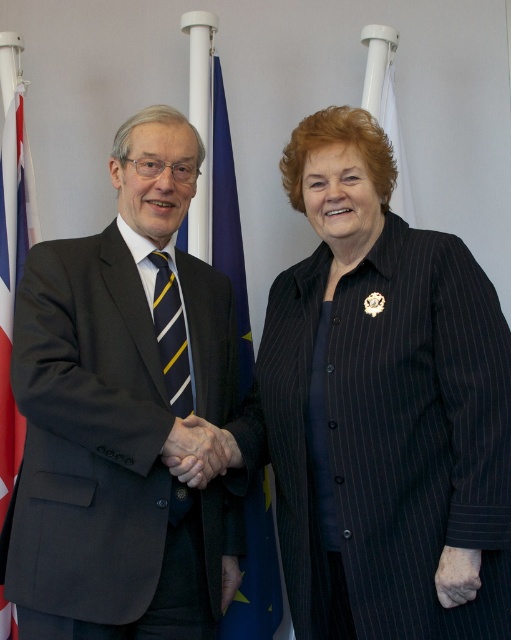
Question: Considering the relative positions of dark gray suit at left and black pinstripe coat at center in the image provided, where is dark gray suit at left located with respect to black pinstripe coat at center?

Choices:
 (A) below
 (B) above

Answer: (B)

Question: Can you confirm if black pinstripe coat at center is smaller than blue fabric flag at center?

Choices:
 (A) yes
 (B) no

Answer: (B)

Question: Which object is farther from the camera taking this photo?

Choices:
 (A) black pinstripe coat at center
 (B) red fabric flag at left
 (C) smooth skin hand at center

Answer: (B)

Question: Which object is the farthest from the dark gray suit at left?

Choices:
 (A) black pinstripe coat at center
 (B) blue fabric flag at center
 (C) red fabric flag at left
 (D) smooth skin hand at center

Answer: (C)

Question: Does blue fabric flag at center appear on the left side of red fabric flag at left?

Choices:
 (A) yes
 (B) no

Answer: (B)

Question: Considering the real-world distances, which object is closest to the blue fabric flag at center?

Choices:
 (A) yellow and blue striped tie at left
 (B) dark gray suit at left

Answer: (A)